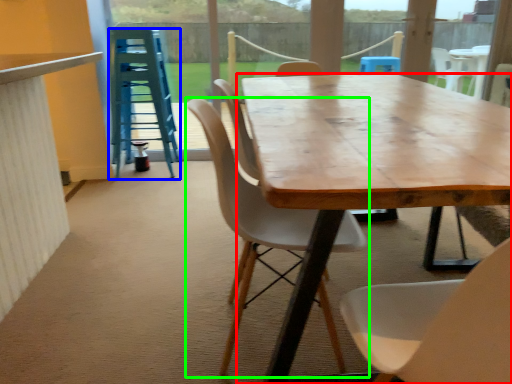
Question: Considering the real-world distances, which object is closest to desk (highlighted by a red box)? stool (highlighted by a blue box) or chair (highlighted by a green box).

Choices:
 (A) stool
 (B) chair

Answer: (B)